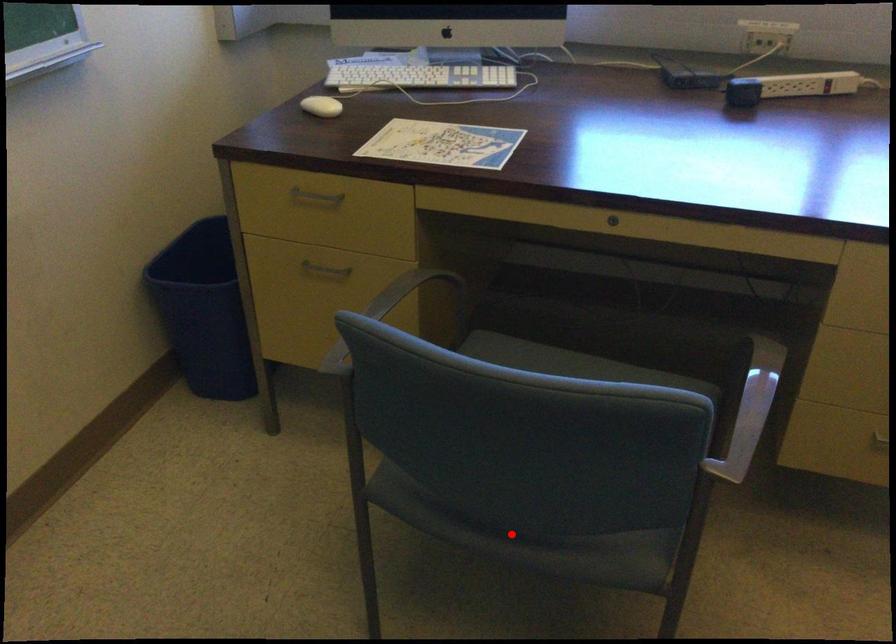
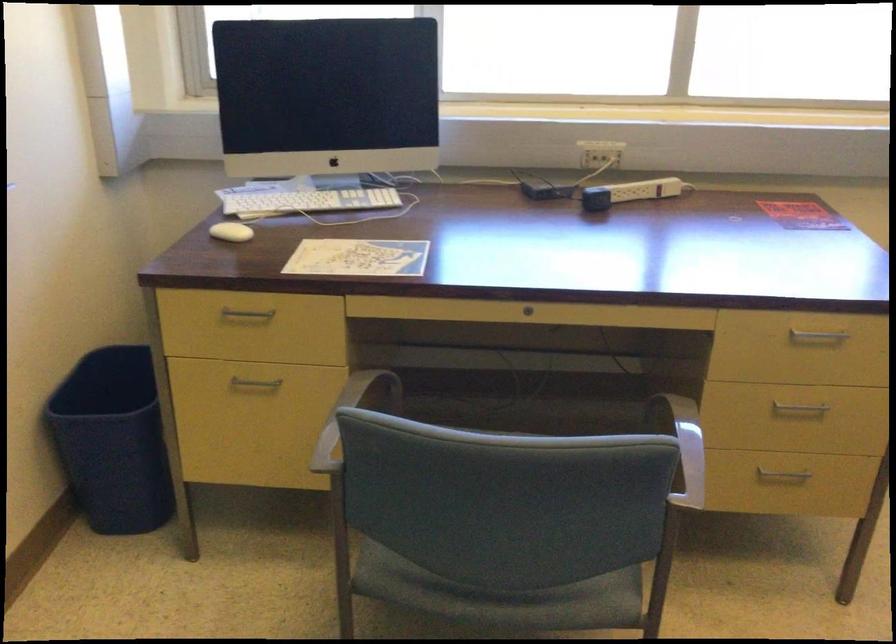
Locate, in the second image, the point that corresponds to the highlighted location in the first image.

(502, 597)